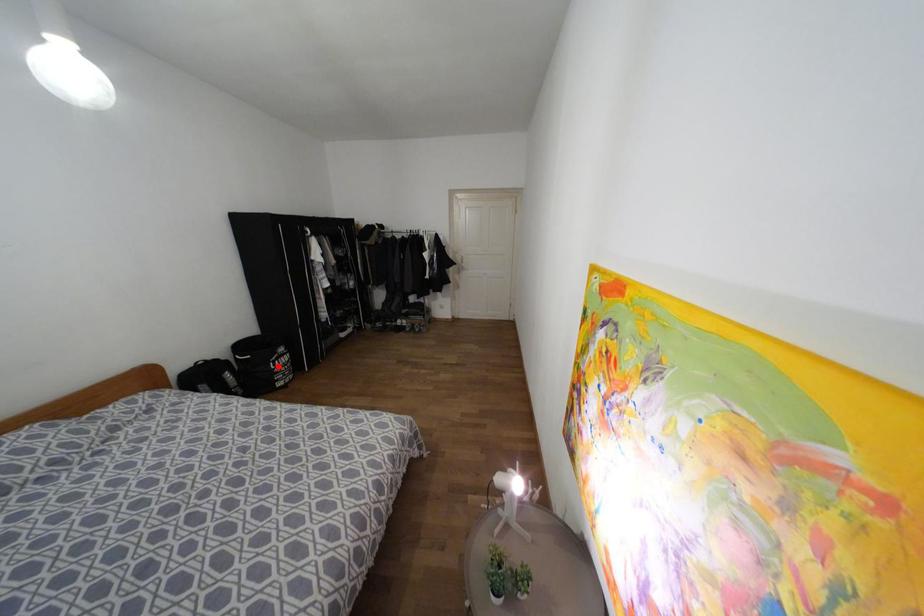
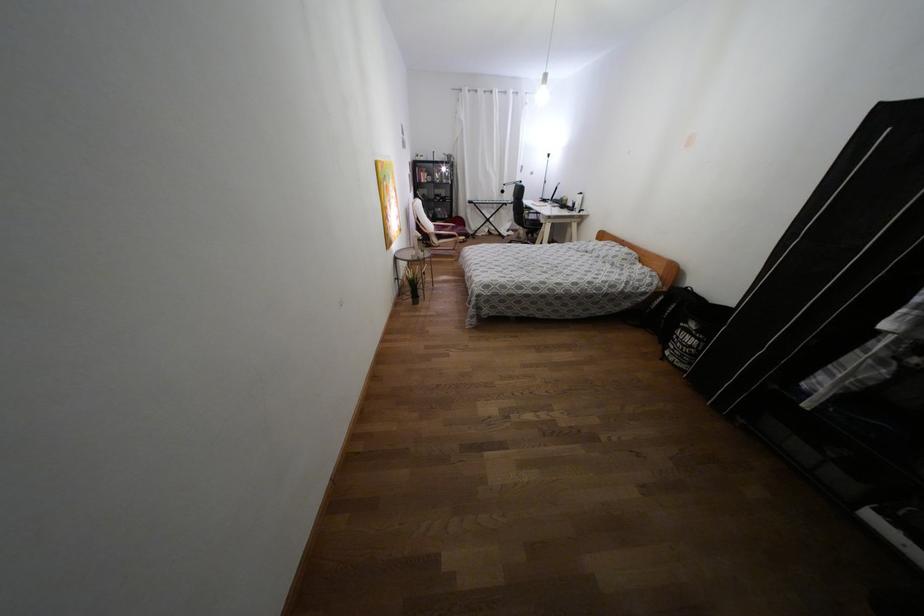
Question: I am providing you with two images of the same scene from different viewpoints. A red point is marked on the first image. At the location where the point appears in image 1, is it still visible in image 2?

Choices:
 (A) Yes
 (B) No

Answer: (A)